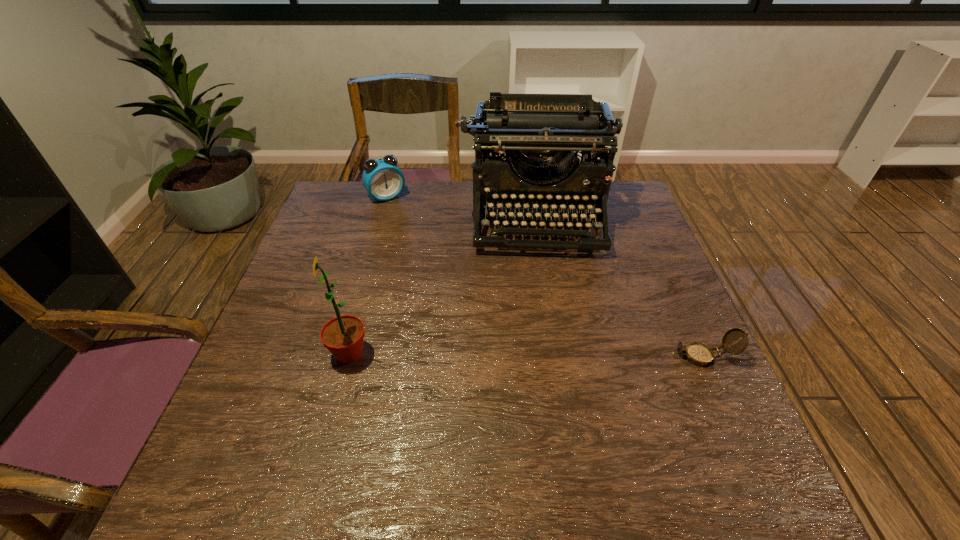
Where is `sunflower`? The width and height of the screenshot is (960, 540). sunflower is located at coordinates (343, 336).

Identify the location of the shortest object. This screenshot has width=960, height=540. (699, 354).

Locate an element on the screen. Image resolution: width=960 pixels, height=540 pixels. typewriter is located at coordinates coord(519,127).

The height and width of the screenshot is (540, 960). I want to click on alarm clock, so click(x=382, y=178).

The image size is (960, 540). I want to click on vacant space situated 0.050m on the face of the sunflower, so click(x=305, y=354).

In order to click on vacant space located on the face of the sunflower in this screenshot , I will do `click(259, 354)`.

In order to click on blank space located on the face of the shortest object in this screenshot , I will do `click(602, 356)`.

This screenshot has height=540, width=960. I want to click on free region located 0.180m on the face of the shortest object, so click(x=588, y=356).

In order to click on vacant area located 0.070m on the face of the shortest object in this screenshot , I will do `click(638, 356)`.

The width and height of the screenshot is (960, 540). I want to click on blank area located on the typing side of the typewriter, so click(542, 275).